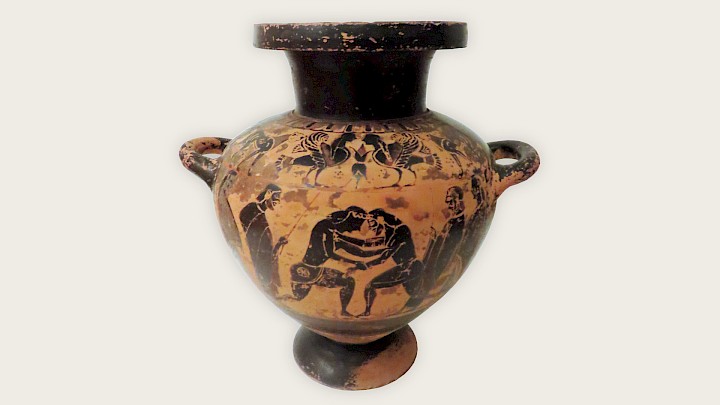
The width and height of the screenshot is (720, 405). What are the coordinates of `vase` in the screenshot? It's located at (391, 206).